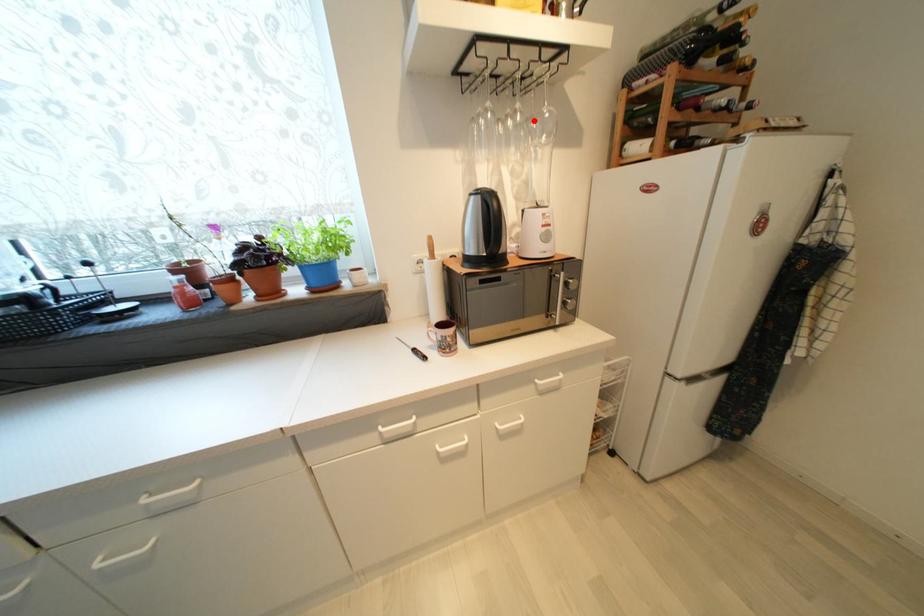
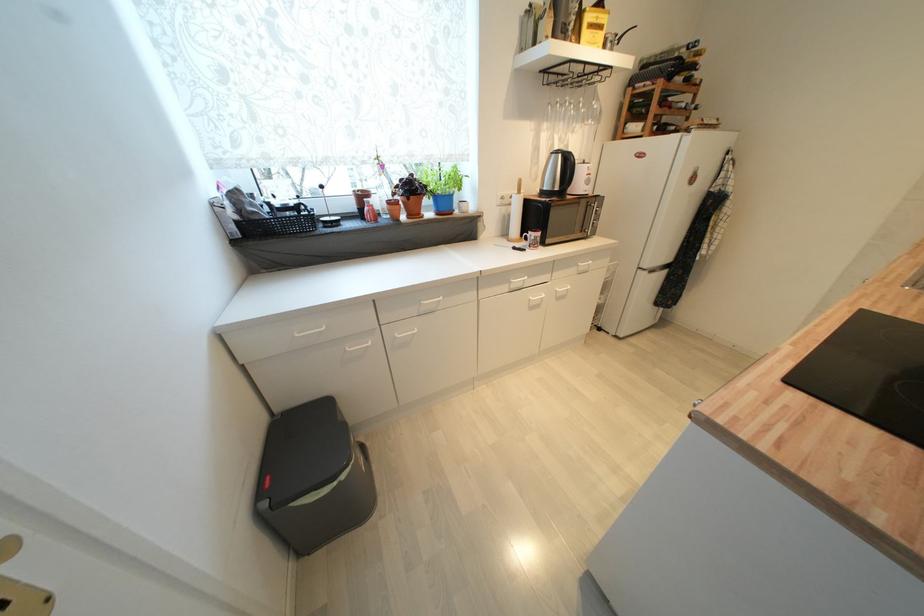
Find the pixel in the second image that matches the highlighted location in the first image.

(589, 108)